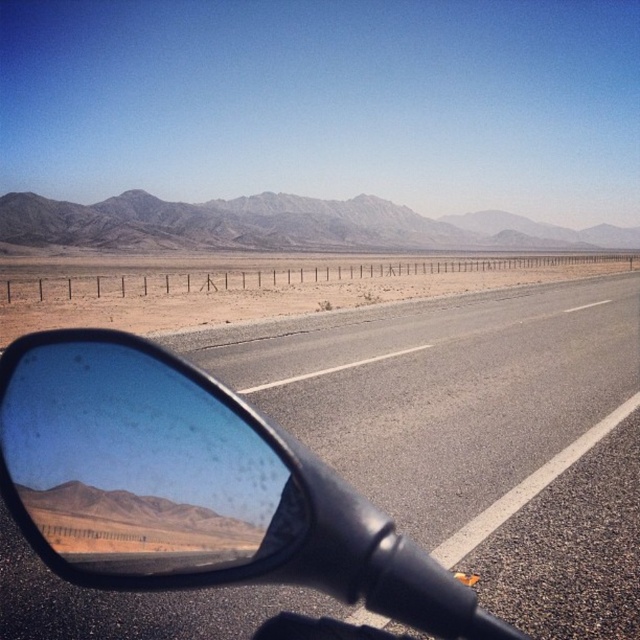
Is asphalt road at center to the right of gray rocky mountain at upper center from the viewer's perspective?

No, asphalt road at center is not to the right of gray rocky mountain at upper center.

Between point (470, 433) and point (417, 244), which one is positioned in front?

Positioned in front is point (470, 433).

Is point (545, 449) positioned in front of point (152, 237)?

Yes, point (545, 449) is closer to viewer.

Identify the location of asphalt road at center. The width and height of the screenshot is (640, 640). (445, 400).

Is glossy black mirror at lower left wider than gray rocky mountain at upper center?

Incorrect, glossy black mirror at lower left's width does not surpass gray rocky mountain at upper center's.

The image size is (640, 640). Identify the location of glossy black mirror at lower left. (140, 465).

Locate an element on the screen. The image size is (640, 640). glossy black mirror at lower left is located at coordinates (140, 465).

Who is positioned more to the left, asphalt road at center or glossy black mirror at lower left?

glossy black mirror at lower left

Can you confirm if asphalt road at center is positioned to the right of glossy black mirror at lower left?

Correct, you'll find asphalt road at center to the right of glossy black mirror at lower left.

The image size is (640, 640). What do you see at coordinates (445, 400) in the screenshot?
I see `asphalt road at center` at bounding box center [445, 400].

This screenshot has width=640, height=640. Find the location of `asphalt road at center`. asphalt road at center is located at coordinates (445, 400).